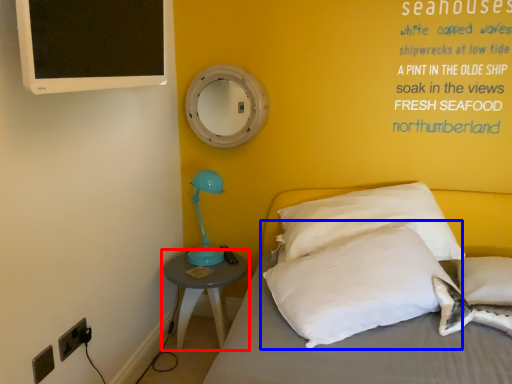
Question: Which object is closer to the camera taking this photo, nightstand (highlighted by a red box) or pillow (highlighted by a blue box)?

Choices:
 (A) nightstand
 (B) pillow

Answer: (B)